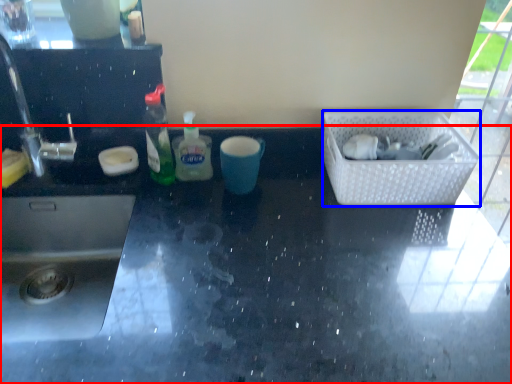
Question: Which object appears farthest to the camera in this image, countertop (highlighted by a red box) or basket (highlighted by a blue box)?

Choices:
 (A) countertop
 (B) basket

Answer: (B)